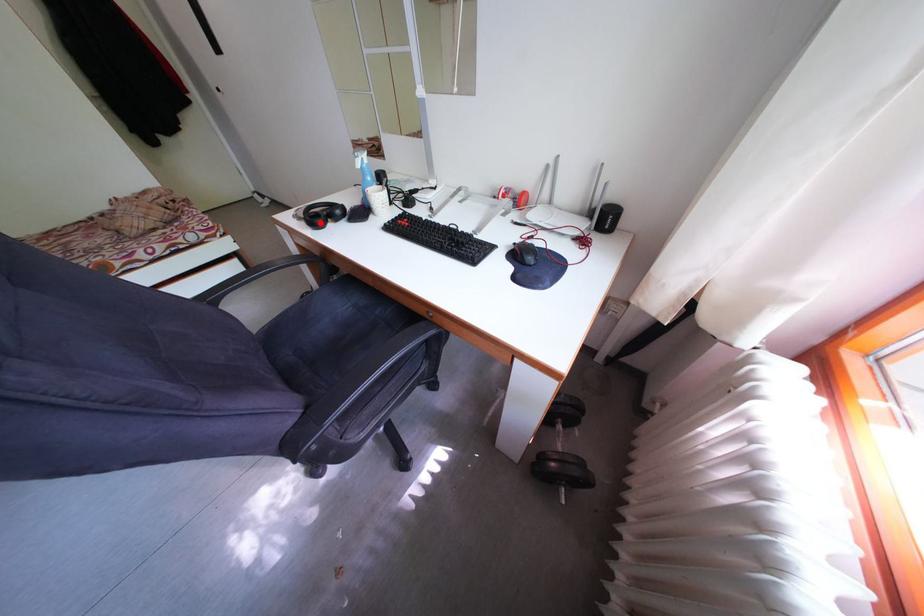
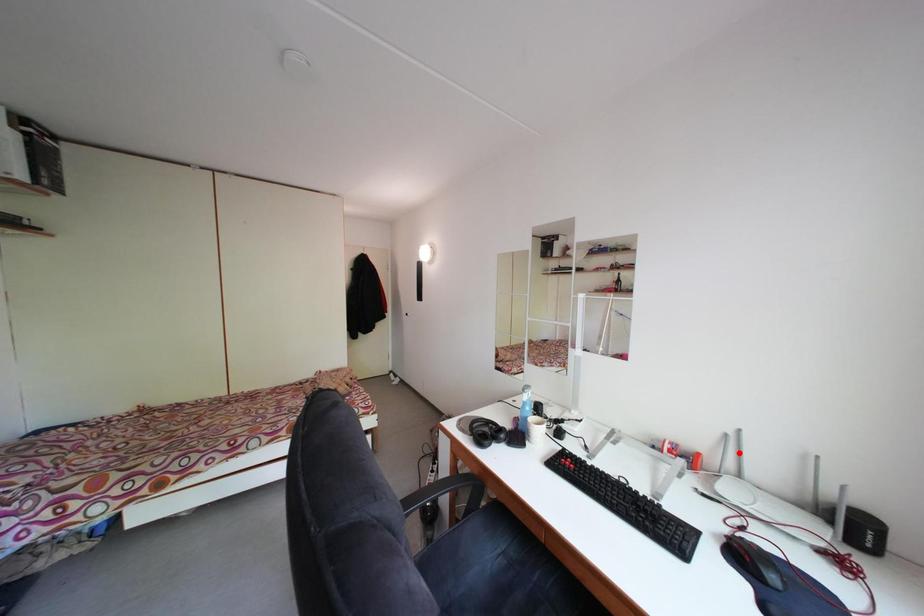
I am providing you with two images of the same scene from different viewpoints. A red point is marked on the first image and another point is marked on the second image. Does the point marked in image1 correspond to the same location as the one in image2?

No